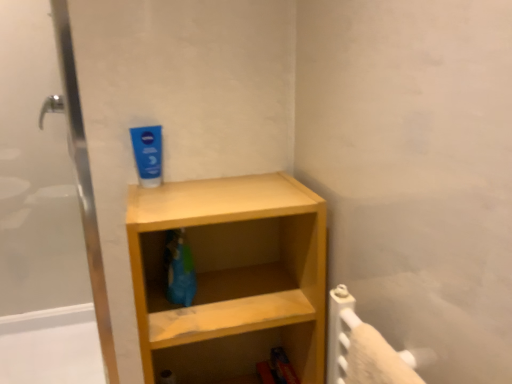
Measure the distance between blue matte toothpaste at upper center and camera.

The depth of blue matte toothpaste at upper center is 38.87 inches.

This screenshot has height=384, width=512. What do you see at coordinates (148, 154) in the screenshot? I see `blue matte toothpaste at upper center` at bounding box center [148, 154].

Where is `blue matte toothpaste at upper center`? The image size is (512, 384). blue matte toothpaste at upper center is located at coordinates (148, 154).

The height and width of the screenshot is (384, 512). Describe the element at coordinates (232, 276) in the screenshot. I see `light wood shelf at center` at that location.

At what (x,y) coordinates should I click in order to perform the action: click on light wood shelf at center. Please return your answer as a coordinate pair (x, y). The width and height of the screenshot is (512, 384). Looking at the image, I should click on (232, 276).

Measure the distance between light wood shelf at center and camera.

A distance of 31.08 inches exists between light wood shelf at center and camera.

Where is `blue matte toothpaste at upper center`? blue matte toothpaste at upper center is located at coordinates (148, 154).

Does blue matte toothpaste at upper center appear on the right side of light wood shelf at center?

No.

Between blue matte toothpaste at upper center and light wood shelf at center, which one is positioned in front?

light wood shelf at center is more forward.

Does point (156, 139) appear closer or farther from the camera than point (280, 202)?

Point (156, 139) is positioned farther from the camera compared to point (280, 202).

From the image's perspective, is blue matte toothpaste at upper center located above or below light wood shelf at center?

Based on their image positions, blue matte toothpaste at upper center is located above light wood shelf at center.

From a real-world perspective, is blue matte toothpaste at upper center physically below light wood shelf at center?

No, from a real-world perspective, blue matte toothpaste at upper center is not below light wood shelf at center.

Which of these two, blue matte toothpaste at upper center or light wood shelf at center, is wider?

Wider between the two is light wood shelf at center.

Is blue matte toothpaste at upper center taller or shorter than light wood shelf at center?

Clearly, blue matte toothpaste at upper center is shorter compared to light wood shelf at center.

Can you confirm if blue matte toothpaste at upper center is bigger than light wood shelf at center?

Actually, blue matte toothpaste at upper center might be smaller than light wood shelf at center.

Could light wood shelf at center be considered to be inside blue matte toothpaste at upper center?

That's incorrect, light wood shelf at center is not inside blue matte toothpaste at upper center.

Is blue matte toothpaste at upper center beside light wood shelf at center?

blue matte toothpaste at upper center and light wood shelf at center are clearly separated.

Could you tell me if blue matte toothpaste at upper center is turned towards light wood shelf at center?

No, blue matte toothpaste at upper center is not turned towards light wood shelf at center.

What's the angular difference between blue matte toothpaste at upper center and light wood shelf at center's facing directions?

3.22 degrees separate the facing orientations of blue matte toothpaste at upper center and light wood shelf at center.

Measure the distance from blue matte toothpaste at upper center to light wood shelf at center.

blue matte toothpaste at upper center and light wood shelf at center are 13.47 inches apart.

The width and height of the screenshot is (512, 384). In order to click on toothpaste behind the light wood shelf at center in this screenshot , I will do [148, 154].

Does light wood shelf at center appear on the right side of blue matte toothpaste at upper center?

Yes.

Which object is closer to the camera taking this photo, light wood shelf at center or blue matte toothpaste at upper center?

light wood shelf at center is more forward.

Between point (301, 243) and point (148, 177), which one is positioned behind?

The point (301, 243) is behind.

From the image's perspective, which one is positioned higher, light wood shelf at center or blue matte toothpaste at upper center?

blue matte toothpaste at upper center, from the image's perspective.

From a real-world perspective, is light wood shelf at center positioned over blue matte toothpaste at upper center based on gravity?

No, from a real-world perspective, light wood shelf at center is not on top of blue matte toothpaste at upper center.

Can you confirm if light wood shelf at center is wider than blue matte toothpaste at upper center?

Correct, the width of light wood shelf at center exceeds that of blue matte toothpaste at upper center.

Considering the relative sizes of light wood shelf at center and blue matte toothpaste at upper center in the image provided, is light wood shelf at center taller than blue matte toothpaste at upper center?

Yes, light wood shelf at center is taller than blue matte toothpaste at upper center.

Considering the sizes of objects light wood shelf at center and blue matte toothpaste at upper center in the image provided, who is bigger, light wood shelf at center or blue matte toothpaste at upper center?

light wood shelf at center.

In the scene shown: Would you say light wood shelf at center is outside blue matte toothpaste at upper center?

Yes.

Is light wood shelf at center touching blue matte toothpaste at upper center?

They are not placed beside each other.

Could you tell me if light wood shelf at center is facing blue matte toothpaste at upper center?

No, light wood shelf at center is not facing towards blue matte toothpaste at upper center.

What's the angular difference between light wood shelf at center and blue matte toothpaste at upper center's facing directions?

3.22 degrees.

I want to click on shelf below the blue matte toothpaste at upper center (from the image's perspective), so click(x=232, y=276).

Where is `shelf located on the right of blue matte toothpaste at upper center`? The height and width of the screenshot is (384, 512). shelf located on the right of blue matte toothpaste at upper center is located at coordinates 232,276.

You are a GUI agent. You are given a task and a screenshot of the screen. Output one action in this format:
    pyautogui.click(x=<x>, y=<y>)
    Task: Click on the toothpaste behind the light wood shelf at center
    
    Given the screenshot: What is the action you would take?
    pyautogui.click(x=148, y=154)